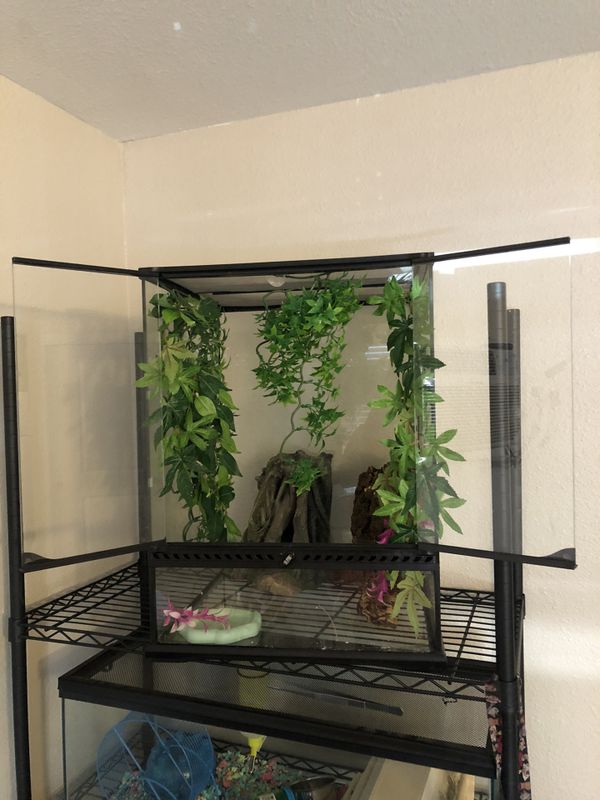
I want to click on plastic greenery, so click(189, 398), click(309, 320), click(397, 461).